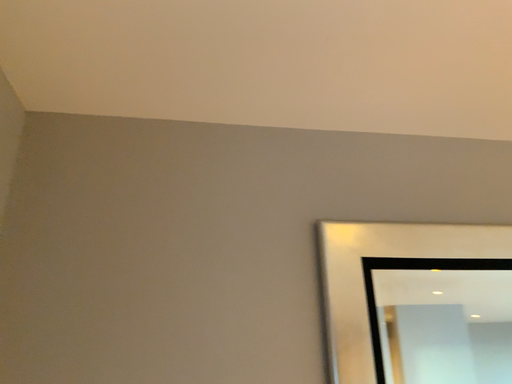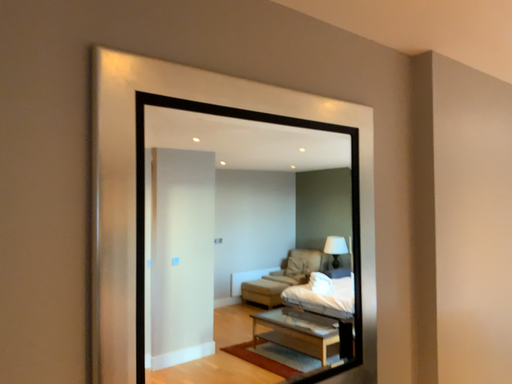
Question: How did the camera likely rotate when shooting the video?

Choices:
 (A) rotated left
 (B) rotated right

Answer: (B)